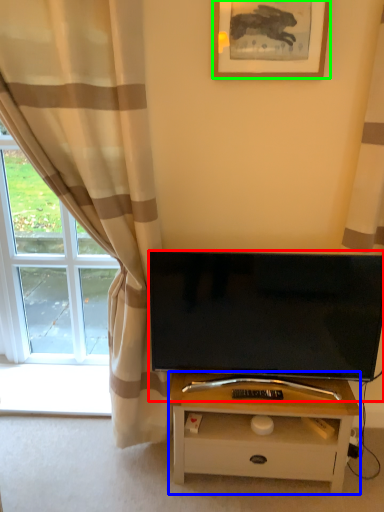
Question: Which object is positioned farthest from television (highlighted by a red box)? Select from table (highlighted by a blue box) and picture frame (highlighted by a green box).

Choices:
 (A) table
 (B) picture frame

Answer: (B)